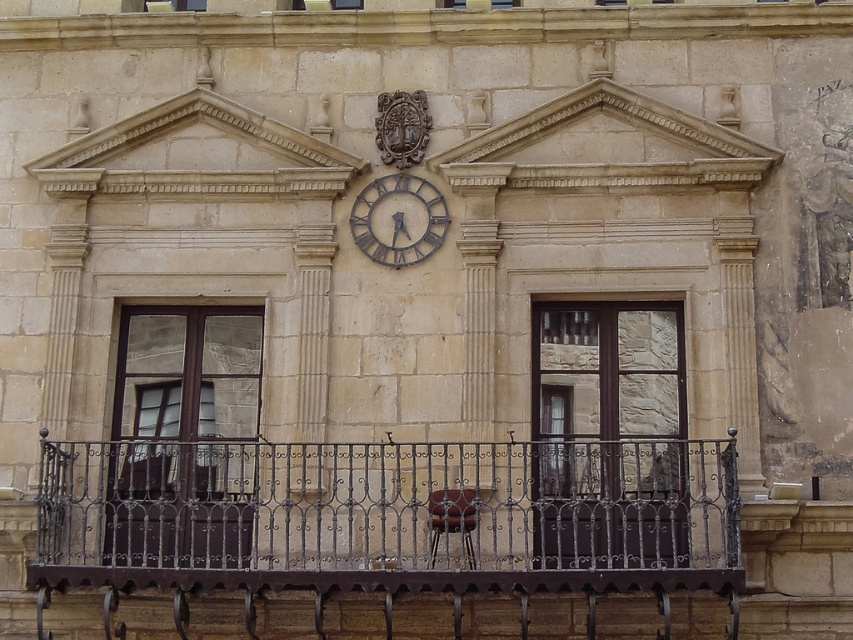
Who is shorter, dark brown wrought iron at center or rusty metal clock at center?

rusty metal clock at center

Is the position of dark brown wrought iron at center less distant than that of rusty metal clock at center?

That is True.

Between point (428, 566) and point (431, 241), which one is positioned behind?

Positioned behind is point (431, 241).

The image size is (853, 640). I want to click on dark brown wrought iron at center, so (389, 515).